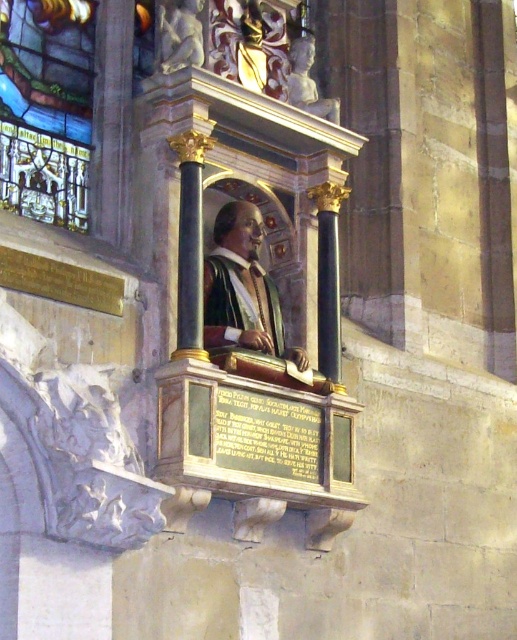
Question: Based on their relative distances, which object is farther from the matte gold robe at center?

Choices:
 (A) polished marble cherub at upper left
 (B) stained glass window at upper left

Answer: (A)

Question: Which object is the farthest from the matte gold statue at center?

Choices:
 (A) matte gold robe at center
 (B) polished marble bust at upper center

Answer: (B)

Question: Observing the image, what is the correct spatial positioning of stained glass window at upper left in reference to polished marble cherub at upper left?

Choices:
 (A) left
 (B) right

Answer: (A)

Question: Which of the following is the closest to the observer?

Choices:
 (A) click(x=21, y=8)
 (B) click(x=255, y=244)
 (C) click(x=171, y=56)
 (D) click(x=303, y=77)

Answer: (C)

Question: Is matte gold statue at center closer to the viewer compared to matte gold robe at center?

Choices:
 (A) yes
 (B) no

Answer: (B)

Question: In this image, where is stained glass window at upper left located relative to polished marble bust at upper center?

Choices:
 (A) below
 (B) above

Answer: (A)